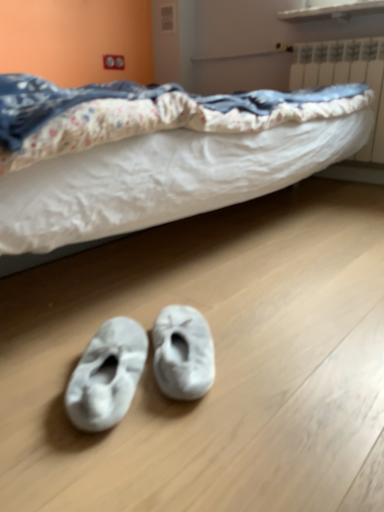
Where is `free space to the back side of white fuzzy slippers at lower center, the 1th footwear positioned from the left`? Image resolution: width=384 pixels, height=512 pixels. free space to the back side of white fuzzy slippers at lower center, the 1th footwear positioned from the left is located at coordinates (92, 323).